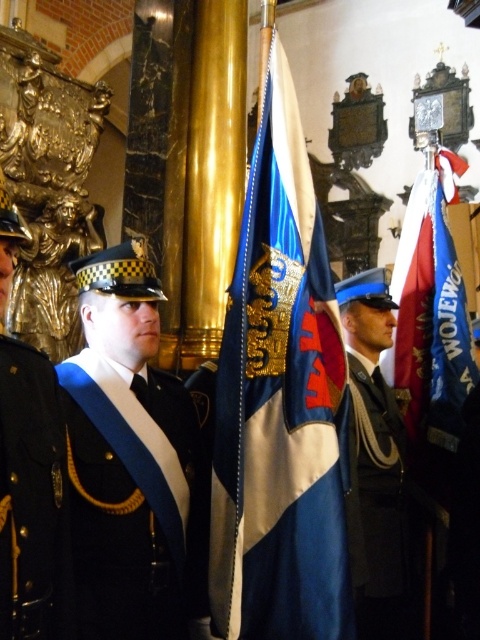
Can you confirm if shiny blue sash at center is smaller than blue fabric flag at right?

Yes.

Is shiny blue sash at center above blue fabric flag at right?

Actually, shiny blue sash at center is below blue fabric flag at right.

Where is `shiny blue sash at center`? shiny blue sash at center is located at coordinates (134, 502).

Between black leather uniform at center and shiny black uniform at center, which one is positioned higher?

black leather uniform at center is higher up.

Is black leather uniform at center smaller than shiny black uniform at center?

Correct, black leather uniform at center occupies less space than shiny black uniform at center.

Who is more distant from viewer, [47,577] or [360,524]?

The point [360,524] is behind.

The height and width of the screenshot is (640, 480). Find the location of `black leather uniform at center`. black leather uniform at center is located at coordinates (32, 499).

Where is `shiny blue sash at center`? The width and height of the screenshot is (480, 640). shiny blue sash at center is located at coordinates (134, 502).

Does shiny blue sash at center appear over shiny black uniform at center?

Actually, shiny blue sash at center is below shiny black uniform at center.

This screenshot has height=640, width=480. In order to click on shiny blue sash at center in this screenshot , I will do `click(134, 502)`.